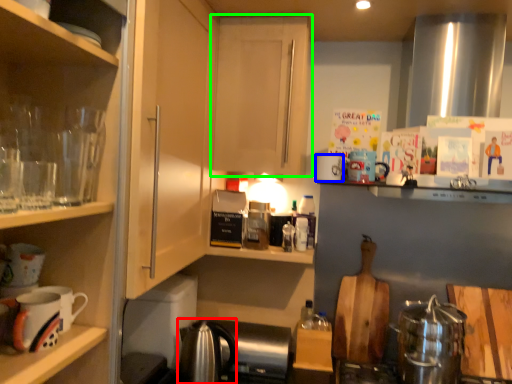
Question: Based on their relative distances, which object is farther from tea pot (highlighted by a red box)? Choose from mug (highlighted by a blue box) and cabinetry (highlighted by a green box).

Choices:
 (A) mug
 (B) cabinetry

Answer: (B)